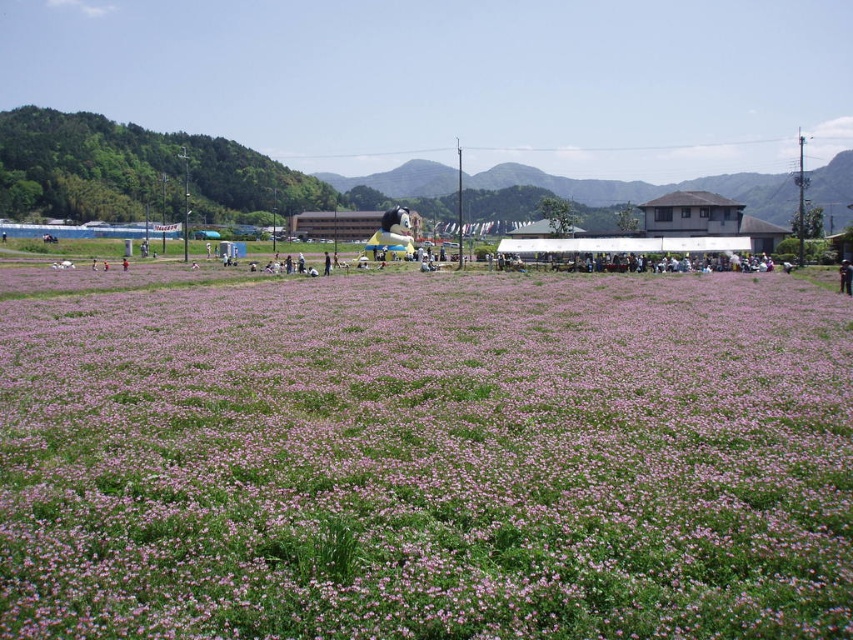
You are standing in the middle of the pink flower field and see two points marked in the scene. Which point is closer to you, point (x=657, y=476) or point (x=840, y=273)?

Point (x=657, y=476) is closer to the viewer than point (x=840, y=273).

You are a photographer trying to capture the brown leather jacket at lower right in your shot. You notice the pink matte flowers at center are blocking the view. Can you determine if the flowers are larger than the jacket?

The pink matte flowers at center is bigger than brown leather jacket at lower right, so yes, the flowers are larger and might block the jacket from view.